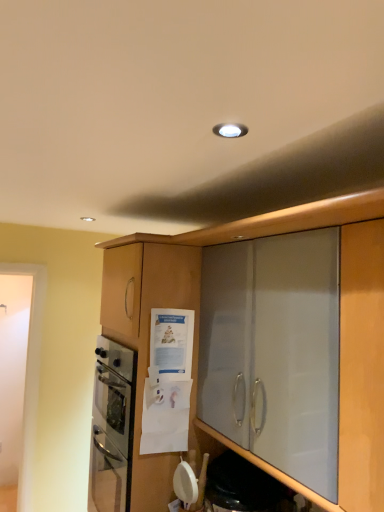
Question: Would you say matte wood cabinet at center is to the left or to the right of transparent glass shelf at lower center in the picture?

Choices:
 (A) right
 (B) left

Answer: (B)

Question: Is point (145, 279) positioned closer to the camera than point (317, 494)?

Choices:
 (A) closer
 (B) farther

Answer: (B)

Question: From a real-world perspective, is matte wood cabinet at center positioned above or below transparent glass shelf at lower center?

Choices:
 (A) below
 (B) above

Answer: (B)

Question: Based on their positions, is transparent glass shelf at lower center located to the left or right of matte wood cabinet at center?

Choices:
 (A) left
 (B) right

Answer: (B)

Question: Is transparent glass shelf at lower center wider or thinner than matte wood cabinet at center?

Choices:
 (A) wide
 (B) thin

Answer: (B)

Question: Do you think transparent glass shelf at lower center is within matte wood cabinet at center, or outside of it?

Choices:
 (A) outside
 (B) inside

Answer: (A)

Question: Considering the positions of transparent glass shelf at lower center and matte wood cabinet at center in the image, is transparent glass shelf at lower center bigger or smaller than matte wood cabinet at center?

Choices:
 (A) small
 (B) big

Answer: (A)